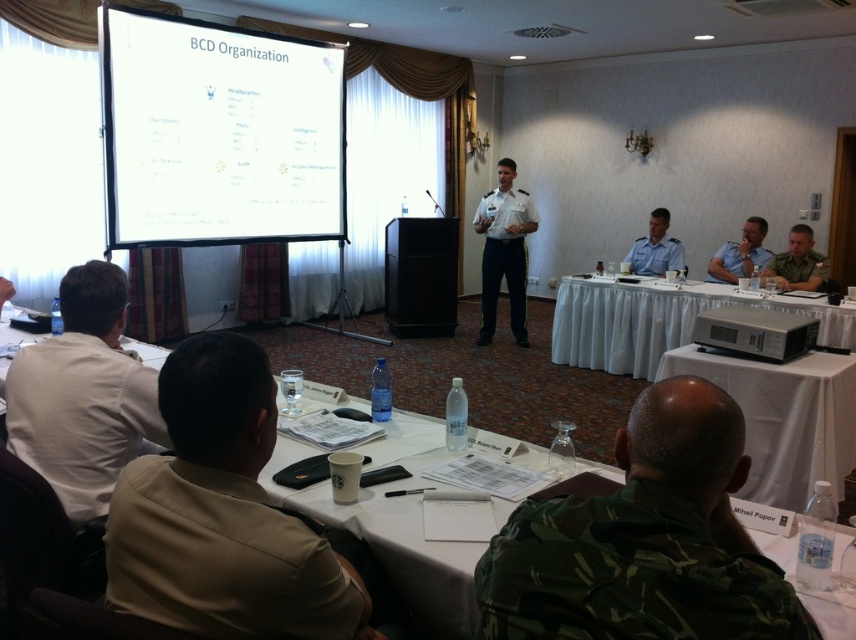
Can you confirm if white shirt at left is thinner than white cloth-covered table at center?

Indeed, white shirt at left has a lesser width compared to white cloth-covered table at center.

Between point (152, 442) and point (805, 388), which one is positioned in front?

Point (152, 442) is more forward.

At what (x,y) coordinates should I click in order to perform the action: click on white shirt at left. Please return your answer as a coordinate pair (x, y). Looking at the image, I should click on (82, 394).

Is white matte projection screen at upper center further to the viewer compared to white cloth-covered table at center?

That is True.

Is white matte projection screen at upper center positioned in front of white cloth-covered table at center?

No.

Is point (256, 109) closer to viewer compared to point (807, 356)?

That is False.

Where is `white matte projection screen at upper center`? white matte projection screen at upper center is located at coordinates (218, 132).

What do you see at coordinates (415, 440) in the screenshot? Image resolution: width=856 pixels, height=640 pixels. I see `white paper at center` at bounding box center [415, 440].

Which is more to the right, white paper at center or camouflage uniform at right?

camouflage uniform at right is more to the right.

Who is more distant from viewer, (15, 584) or (795, 289)?

The point (795, 289) is behind.

In order to click on white paper at center in this screenshot , I will do `click(415, 440)`.